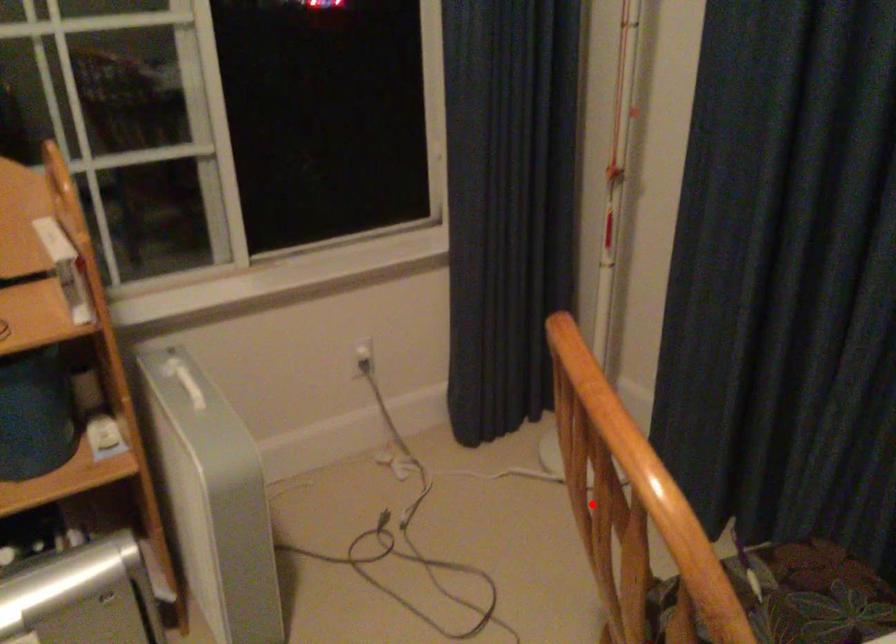
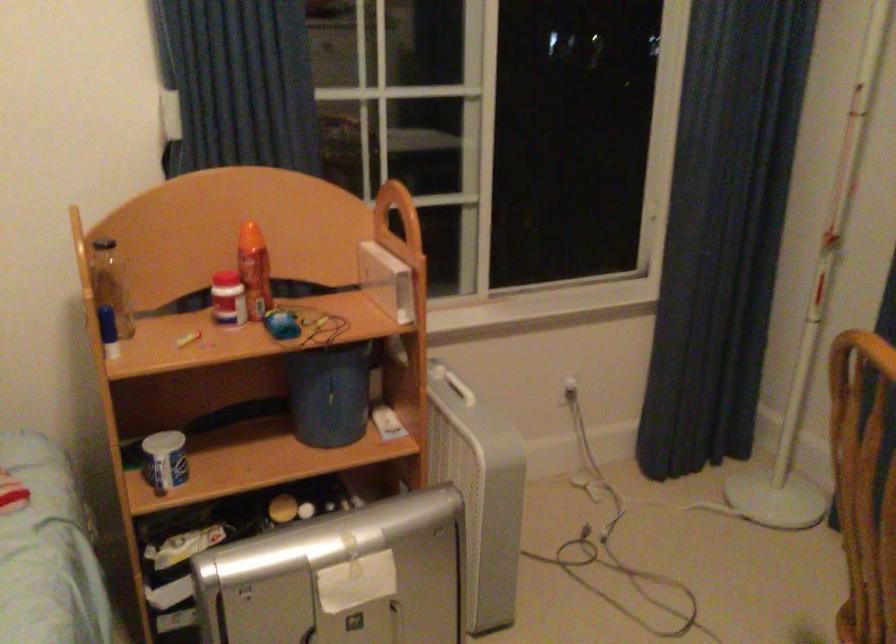
Question: I am providing you with two images of the same scene from different viewpoints. A red point is marked on the first image. Can you still see the location of the red point in image 2?

Choices:
 (A) Yes
 (B) No

Answer: (A)